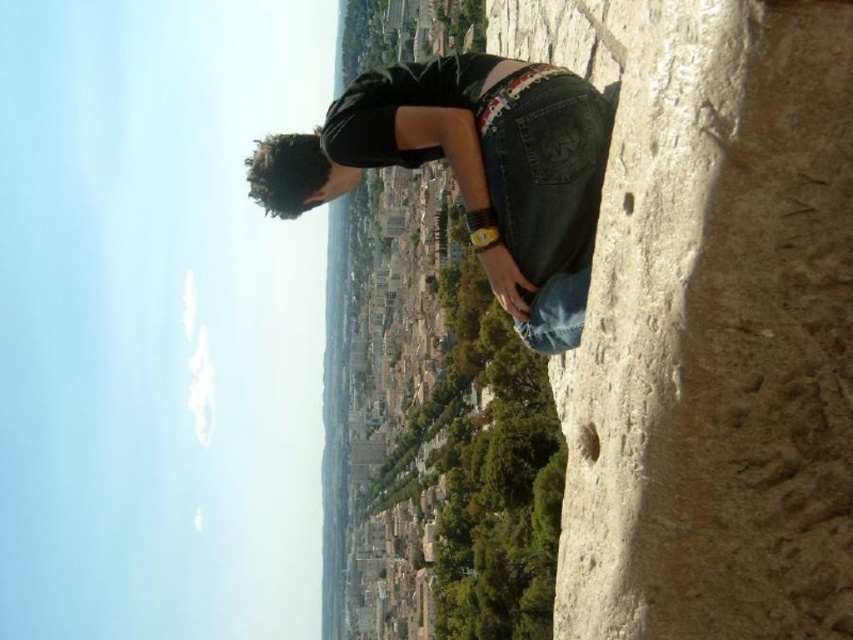
Is rough stone cliff at right to the right of jeans at center from the viewer's perspective?

Correct, you'll find rough stone cliff at right to the right of jeans at center.

Is rough stone cliff at right thinner than jeans at center?

Indeed, rough stone cliff at right has a lesser width compared to jeans at center.

Identify the location of rough stone cliff at right. Image resolution: width=853 pixels, height=640 pixels. tap(708, 321).

Locate an element on the screen. The width and height of the screenshot is (853, 640). rough stone cliff at right is located at coordinates pyautogui.click(x=708, y=321).